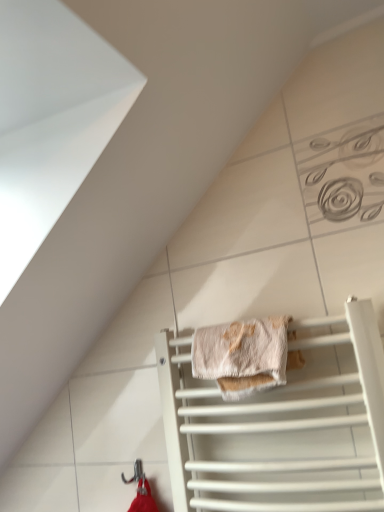
Question: From the image's perspective, is white matte towel rack at lower center above beige textured towel at center?

Choices:
 (A) no
 (B) yes

Answer: (A)

Question: From a real-world perspective, is white matte towel rack at lower center positioned under beige textured towel at center based on gravity?

Choices:
 (A) no
 (B) yes

Answer: (B)

Question: Does white matte towel rack at lower center have a larger size compared to beige textured towel at center?

Choices:
 (A) no
 (B) yes

Answer: (B)

Question: Does white matte towel rack at lower center have a lesser height compared to beige textured towel at center?

Choices:
 (A) yes
 (B) no

Answer: (B)

Question: Is white matte towel rack at lower center in contact with beige textured towel at center?

Choices:
 (A) yes
 (B) no

Answer: (B)

Question: Is beige textured towel at center bigger or smaller than metallic hook at lower center?

Choices:
 (A) small
 (B) big

Answer: (B)

Question: Is beige textured towel at center to the left or to the right of metallic hook at lower center in the image?

Choices:
 (A) left
 (B) right

Answer: (B)

Question: Is beige textured towel at center inside the boundaries of metallic hook at lower center, or outside?

Choices:
 (A) outside
 (B) inside

Answer: (A)

Question: Relative to metallic hook at lower center, is beige textured towel at center in front or behind?

Choices:
 (A) front
 (B) behind

Answer: (A)

Question: Is point (380, 473) positioned closer to the camera than point (266, 318)?

Choices:
 (A) farther
 (B) closer

Answer: (B)

Question: Looking at the image, does white matte towel rack at lower center seem bigger or smaller compared to beige textured towel at center?

Choices:
 (A) small
 (B) big

Answer: (B)

Question: In terms of height, does white matte towel rack at lower center look taller or shorter compared to beige textured towel at center?

Choices:
 (A) tall
 (B) short

Answer: (A)

Question: Is white matte towel rack at lower center in front of or behind beige textured towel at center in the image?

Choices:
 (A) behind
 (B) front

Answer: (B)

Question: Considering the positions of metallic hook at lower center and white matte towel rack at lower center in the image, is metallic hook at lower center wider or thinner than white matte towel rack at lower center?

Choices:
 (A) wide
 (B) thin

Answer: (B)

Question: Is point (135, 460) closer or farther from the camera than point (253, 470)?

Choices:
 (A) farther
 (B) closer

Answer: (A)